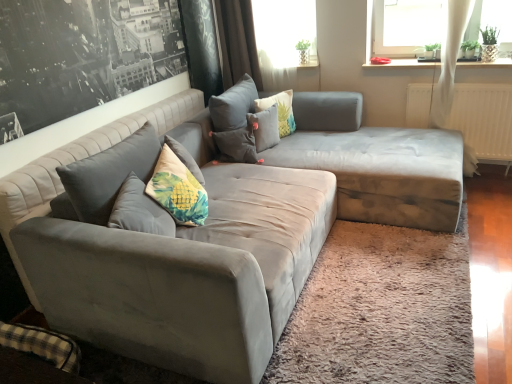
Where is `suede gray couch at center`? suede gray couch at center is located at coordinates (213, 229).

Where is `brown velvet curtain at upper center`? The height and width of the screenshot is (384, 512). brown velvet curtain at upper center is located at coordinates [x=237, y=41].

I want to click on fluffy fabric pillow at center, the second pillow positioned from the right, so point(264,128).

Is fluffy fabric pillow at center, placed as the second pillow when sorted from left to right, thinner than matte gray couch at upper left?

Incorrect, the width of fluffy fabric pillow at center, placed as the second pillow when sorted from left to right, is not less than that of matte gray couch at upper left.

Which is more to the right, fluffy fabric pillow at center, placed as the second pillow when sorted from left to right, or matte gray couch at upper left?

From the viewer's perspective, fluffy fabric pillow at center, placed as the second pillow when sorted from left to right, appears more on the right side.

Which is behind, fluffy fabric pillow at center, the second pillow positioned from the right, or matte gray couch at upper left?

Positioned behind is fluffy fabric pillow at center, the second pillow positioned from the right.

From a real-world perspective, is fluffy fabric pillow at center, placed as the second pillow when sorted from left to right, positioned over matte gray couch at upper left based on gravity?

Actually, fluffy fabric pillow at center, placed as the second pillow when sorted from left to right, is physically below matte gray couch at upper left in the real world.

Which object is positioned more to the right, fluffy fabric pillow at center, placed as the second pillow when sorted from left to right, or velvet floral pillow at center, which is the third pillow from right to left?

Positioned to the right is fluffy fabric pillow at center, placed as the second pillow when sorted from left to right.

Could you tell me if fluffy fabric pillow at center, the second pillow positioned from the right, is turned towards velvet floral pillow at center, acting as the first pillow starting from the left?

No, fluffy fabric pillow at center, the second pillow positioned from the right, is not turned towards velvet floral pillow at center, acting as the first pillow starting from the left.

Which of these two, fluffy fabric pillow at center, the second pillow positioned from the right, or velvet floral pillow at center, acting as the first pillow starting from the left, is bigger?

With larger size is velvet floral pillow at center, acting as the first pillow starting from the left.

What's the angular difference between fluffy fabric pillow at center, the second pillow positioned from the right, and velvet floral pillow at center, acting as the first pillow starting from the left,'s facing directions?

There is a 0.000461-degree angle between the facing directions of fluffy fabric pillow at center, the second pillow positioned from the right, and velvet floral pillow at center, acting as the first pillow starting from the left.

Find the location of a particular element. Image resolution: width=512 pixels, height=384 pixels. curtain that appears above the suede gray couch at center (from a real-world perspective) is located at coordinates (237, 41).

Considering the positions of objects brown velvet curtain at upper center and suede gray couch at center in the image provided, who is more to the right, brown velvet curtain at upper center or suede gray couch at center?

suede gray couch at center.

From a real-world perspective, is brown velvet curtain at upper center physically below suede gray couch at center?

Incorrect, from a real-world perspective, brown velvet curtain at upper center is higher than suede gray couch at center.

Considering the sizes of objects brown velvet curtain at upper center and suede gray couch at center in the image provided, who is thinner, brown velvet curtain at upper center or suede gray couch at center?

brown velvet curtain at upper center.

Considering the sizes of fluffy fabric pillow at center, the second pillow positioned from the right, and suede gray couch at center in the image, is fluffy fabric pillow at center, the second pillow positioned from the right, wider or thinner than suede gray couch at center?

Clearly, fluffy fabric pillow at center, the second pillow positioned from the right, has less width compared to suede gray couch at center.

Identify the location of studio couch on the right of the fluffy fabric pillow at center, the second pillow positioned from the right. Image resolution: width=512 pixels, height=384 pixels. (213, 229).

From a real-world perspective, between fluffy fabric pillow at center, the second pillow positioned from the right, and suede gray couch at center, who is vertically lower?

suede gray couch at center, from a real-world perspective.

Choose the correct answer: Is fluffy fabric pillow at center, the second pillow positioned from the right, inside suede gray couch at center or outside it?

fluffy fabric pillow at center, the second pillow positioned from the right, is enclosed within suede gray couch at center.

Which object is positioned more to the right, matte gray couch at upper left or suede gray couch at center?

Positioned to the right is suede gray couch at center.

Considering the relative sizes of matte gray couch at upper left and suede gray couch at center in the image provided, is matte gray couch at upper left taller than suede gray couch at center?

In fact, matte gray couch at upper left may be shorter than suede gray couch at center.

Does matte gray couch at upper left have a smaller size compared to suede gray couch at center?

Correct, matte gray couch at upper left occupies less space than suede gray couch at center.

Is floral fabric pillow at center, the 1th pillow from the right, facing towards matte gray couch at upper left?

No, floral fabric pillow at center, the 1th pillow from the right, is not facing towards matte gray couch at upper left.

Which object is thinner, floral fabric pillow at center, which is the 3th pillow in left-to-right order, or matte gray couch at upper left?

Thinner between the two is matte gray couch at upper left.

From the image's perspective, is floral fabric pillow at center, the 1th pillow from the right, above or below matte gray couch at upper left?

From the image's perspective, floral fabric pillow at center, the 1th pillow from the right, appears below matte gray couch at upper left.

Which of these two, floral fabric pillow at center, which is the 3th pillow in left-to-right order, or matte gray couch at upper left, stands shorter?

Standing shorter between the two is floral fabric pillow at center, which is the 3th pillow in left-to-right order.

Identify the location of curtain behind the suede gray couch at center. (237, 41).

From a real-world perspective, between suede gray couch at center and brown velvet curtain at upper center, who is vertically lower?

suede gray couch at center.

Is suede gray couch at center located outside brown velvet curtain at upper center?

Yes, suede gray couch at center is located beyond the bounds of brown velvet curtain at upper center.

Is the position of suede gray couch at center more distant than that of brown velvet curtain at upper center?

No, suede gray couch at center is closer to the camera.

Where is `picture frame positioned vertically above the fluffy fabric pillow at center, placed as the second pillow when sorted from left to right (from a real-world perspective)`? picture frame positioned vertically above the fluffy fabric pillow at center, placed as the second pillow when sorted from left to right (from a real-world perspective) is located at coordinates (81, 56).

Locate an element on the screen. pillow that is the 1st object located behind the velvet floral pillow at center, which is the third pillow from right to left is located at coordinates (264, 128).

Estimate the real-world distances between objects in this image. Which object is closer to fluffy fabric pillow at center, placed as the second pillow when sorted from left to right, suede gray couch at center or suede gray couch at center?

Among the two, suede gray couch at center is located nearer to fluffy fabric pillow at center, placed as the second pillow when sorted from left to right.

From the image, which object appears to be nearer to floral fabric pillow at center, the 1th pillow from the right, suede gray couch at center or white sheer curtain at upper center?

white sheer curtain at upper center is positioned closer to the anchor floral fabric pillow at center, the 1th pillow from the right.

Looking at the image, which one is located closer to white sheer curtain at upper center, fluffy fabric pillow at center, the second pillow positioned from the right, or floral fabric pillow at center, which is the 3th pillow in left-to-right order?

floral fabric pillow at center, which is the 3th pillow in left-to-right order, is positioned closer to the anchor white sheer curtain at upper center.

Based on their spatial positions, is suede gray couch at center or matte gray couch at upper left closer to velvet floral pillow at center, acting as the first pillow starting from the left?

suede gray couch at center is positioned closer to the anchor velvet floral pillow at center, acting as the first pillow starting from the left.

When comparing their distances from white sheer curtain at upper center, does brown velvet curtain at upper center or velvet floral pillow at center, acting as the first pillow starting from the left, seem further?

velvet floral pillow at center, acting as the first pillow starting from the left.

Based on their spatial positions, is floral fabric pillow at center, which is the 3th pillow in left-to-right order, or suede gray couch at center closer to fluffy fabric pillow at center, placed as the second pillow when sorted from left to right?

The object closer to fluffy fabric pillow at center, placed as the second pillow when sorted from left to right, is floral fabric pillow at center, which is the 3th pillow in left-to-right order.

Which object lies further to the anchor point brown velvet curtain at upper center, velvet floral pillow at center, acting as the first pillow starting from the left, or matte gray couch at upper left?

matte gray couch at upper left.

From the image, which object appears to be farther from floral fabric pillow at center, which is the 3th pillow in left-to-right order, suede gray couch at center or white sheer curtain at upper center?

The object further to floral fabric pillow at center, which is the 3th pillow in left-to-right order, is suede gray couch at center.

You are a GUI agent. You are given a task and a screenshot of the screen. Output one action in this format:
    pyautogui.click(x=<x>, y=<y>)
    Task: Click on the pillow between brown velvet curtain at upper center and fluffy fabric pillow at center, placed as the second pillow when sorted from left to right, vertically
    
    Given the screenshot: What is the action you would take?
    pyautogui.click(x=280, y=110)

The height and width of the screenshot is (384, 512). Find the location of `studio couch located between matte gray couch at upper left and suede gray couch at center in the left-right direction`. studio couch located between matte gray couch at upper left and suede gray couch at center in the left-right direction is located at coordinates (213, 229).

Locate an element on the screen. Image resolution: width=512 pixels, height=384 pixels. picture frame positioned between suede gray couch at center and fluffy fabric pillow at center, the second pillow positioned from the right, from near to far is located at coordinates (81, 56).

You are a GUI agent. You are given a task and a screenshot of the screen. Output one action in this format:
    pyautogui.click(x=<x>, y=<y>)
    Task: Click on the picture frame between suede gray couch at center and white sheer curtain at upper center along the z-axis
    This screenshot has height=384, width=512.
    Given the screenshot: What is the action you would take?
    pyautogui.click(x=81, y=56)